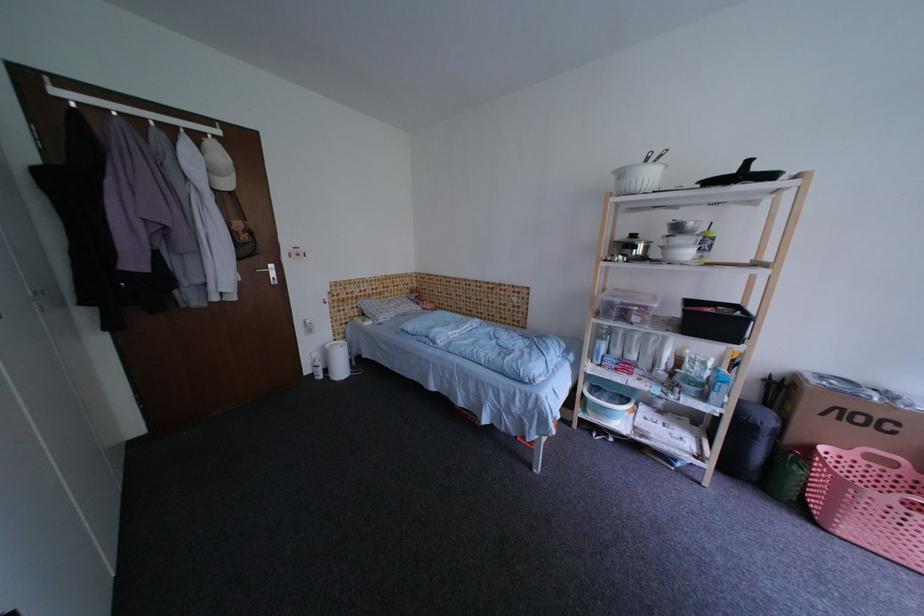
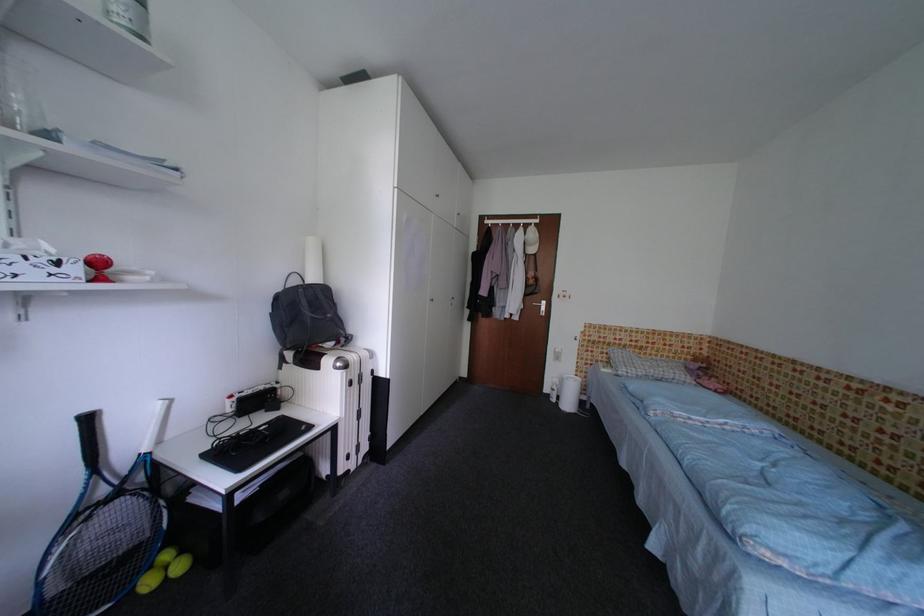
Find the pixel in the second image that matches point 406,297 in the first image.

(675, 360)